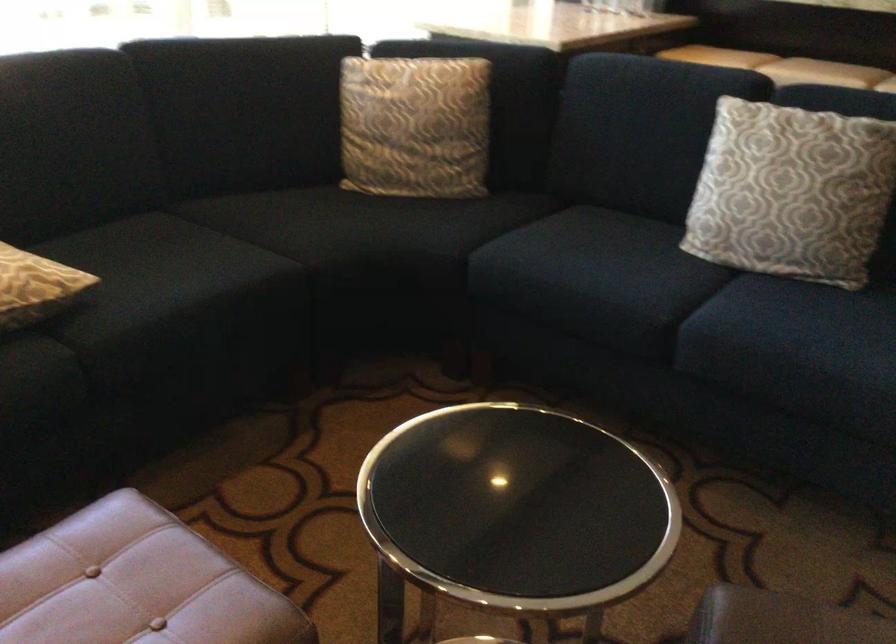
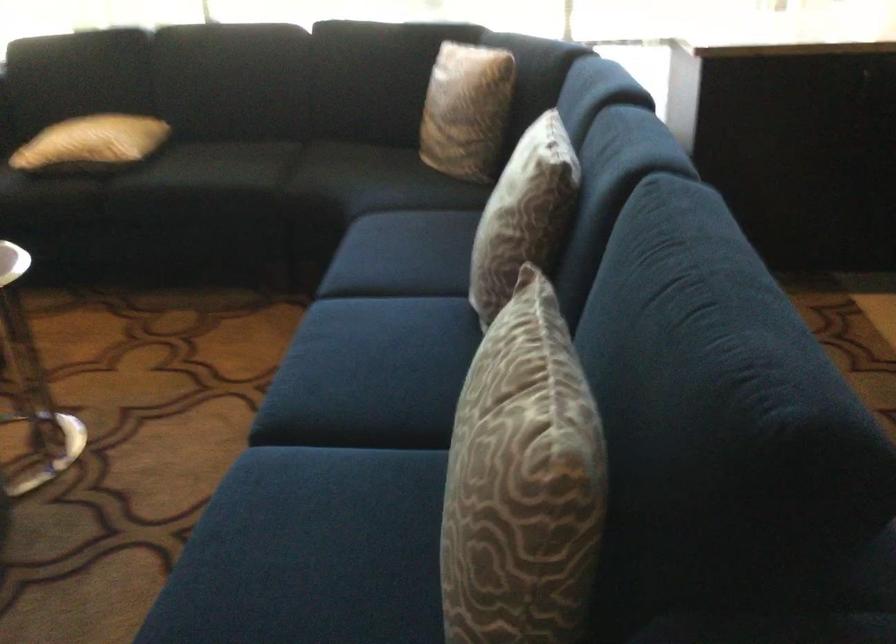
In the second image, find the point that corresponds to point (452, 125) in the first image.

(467, 109)